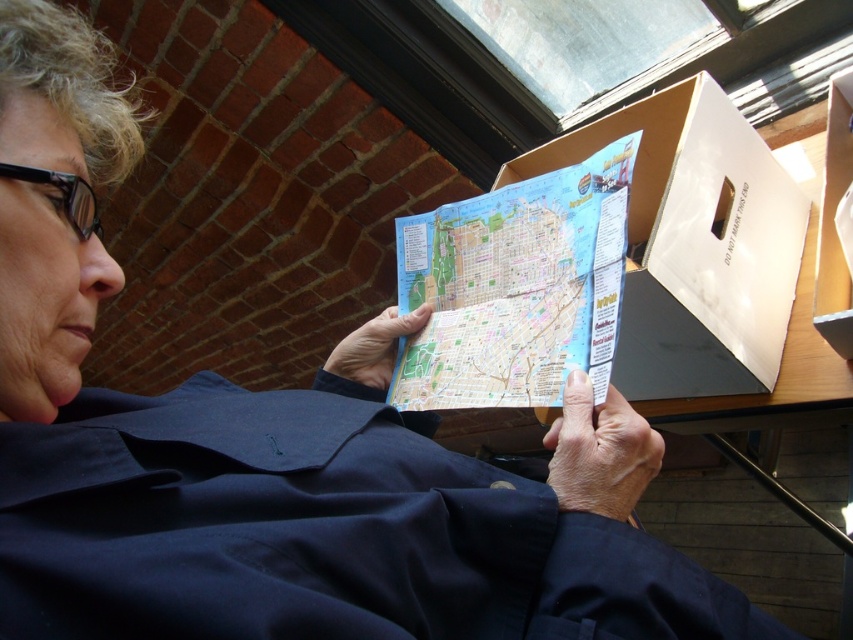
Between navy blue fabric at center and colorful paper map at center, which one appears on the left side from the viewer's perspective?

From the viewer's perspective, navy blue fabric at center appears more on the left side.

Can you confirm if navy blue fabric at center is shorter than colorful paper map at center?

Yes.

The image size is (853, 640). What do you see at coordinates (315, 531) in the screenshot?
I see `navy blue fabric at center` at bounding box center [315, 531].

At what (x,y) coordinates should I click in order to perform the action: click on navy blue fabric at center. Please return your answer as a coordinate pair (x, y). The image size is (853, 640). Looking at the image, I should click on [x=315, y=531].